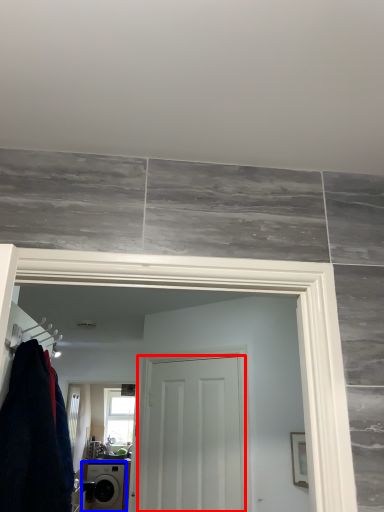
Question: Which point is closer to the camera, door (highlighted by a red box) or washing machine (highlighted by a blue box)?

Choices:
 (A) door
 (B) washing machine

Answer: (A)